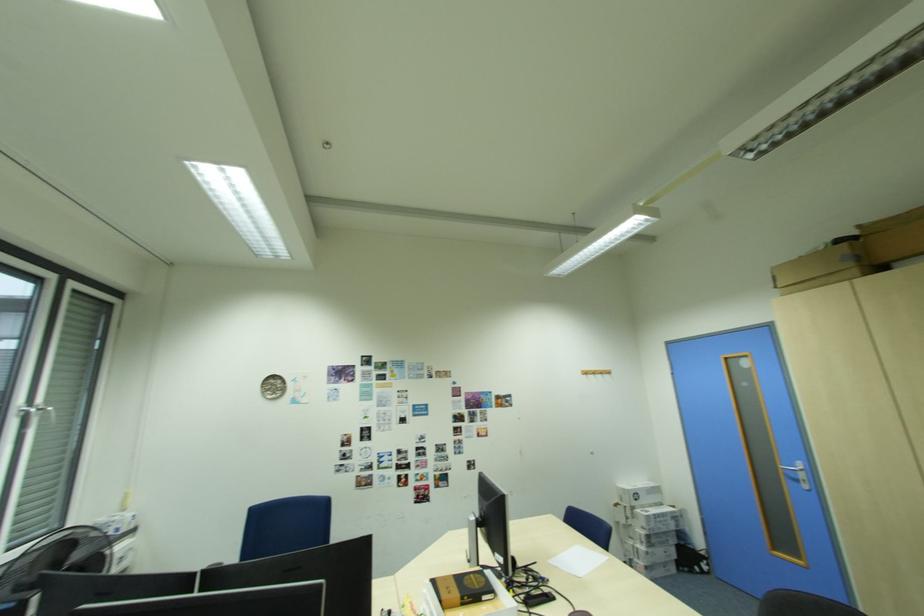
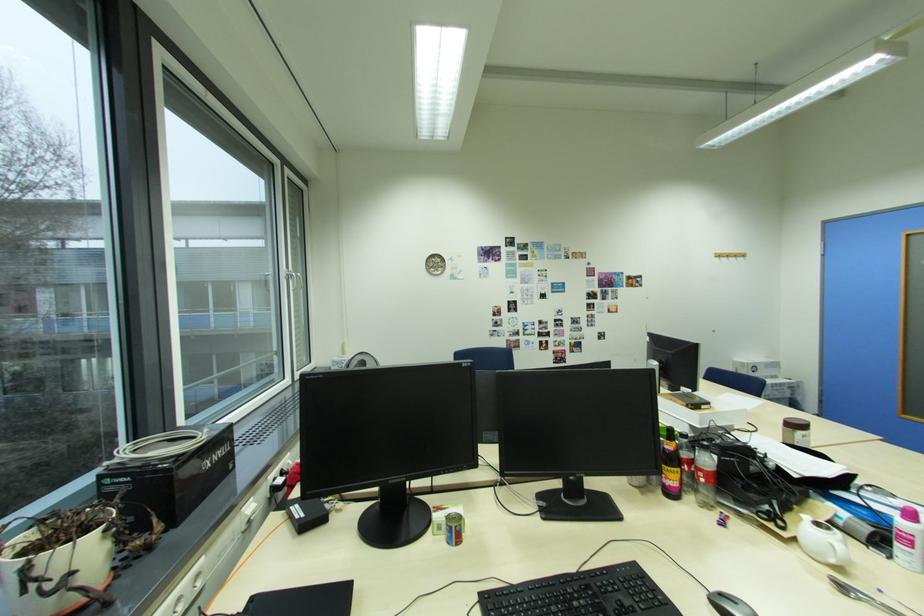
Question: Based on the continuous images, in which direction is the camera rotating? Reply with the corresponding letter.

Choices:
 (A) Left
 (B) Right
 (C) Up
 (D) Down

Answer: (D)